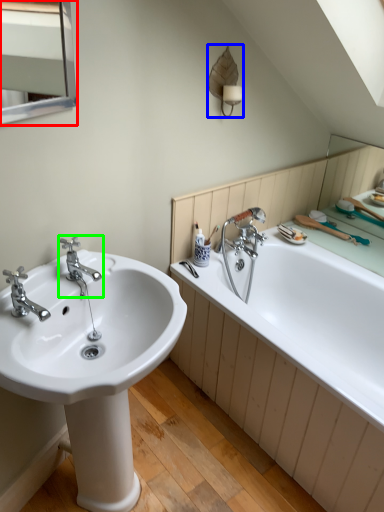
Question: Estimate the real-world distances between objects in this image. Which object is closer to medicine cabinet (highlighted by a red box), fixture (highlighted by a blue box) or tap (highlighted by a green box)?

Choices:
 (A) fixture
 (B) tap

Answer: (A)